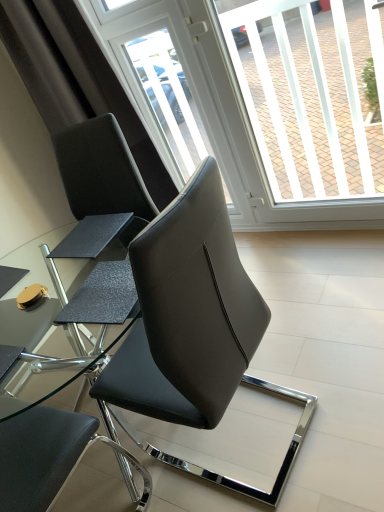
Question: Is black leather chair at center, the 2th chair in the back-to-front sequence, wider than matte black chair at center, marked as the third chair in a front-to-back arrangement?

Choices:
 (A) yes
 (B) no

Answer: (B)

Question: Does black leather chair at center, which is the 2th chair in front-to-back order, turn towards matte black chair at center, marked as the third chair in a front-to-back arrangement?

Choices:
 (A) yes
 (B) no

Answer: (A)

Question: Is the position of black leather chair at center, which is the 2th chair in front-to-back order, more distant than that of matte black chair at center, marked as the third chair in a front-to-back arrangement?

Choices:
 (A) yes
 (B) no

Answer: (B)

Question: Is matte black chair at center, the 1th chair positioned from the back, inside black leather chair at center, the 2th chair in the back-to-front sequence?

Choices:
 (A) no
 (B) yes

Answer: (A)

Question: From a real-world perspective, is black leather chair at center, which is the 2th chair in front-to-back order, physically below matte black chair at center, the 1th chair positioned from the back?

Choices:
 (A) yes
 (B) no

Answer: (A)

Question: Is the position of black leather chair at center, the 2th chair in the back-to-front sequence, less distant than that of matte black chair at center, the 1th chair positioned from the back?

Choices:
 (A) no
 (B) yes

Answer: (B)

Question: Is transparent plastic screen door at upper center next to matte black chair at center, marked as the third chair in a front-to-back arrangement?

Choices:
 (A) yes
 (B) no

Answer: (B)

Question: Can you confirm if transparent plastic screen door at upper center is bigger than matte black chair at center, the 1th chair positioned from the back?

Choices:
 (A) no
 (B) yes

Answer: (A)

Question: From a real-world perspective, is transparent plastic screen door at upper center physically above matte black chair at center, marked as the third chair in a front-to-back arrangement?

Choices:
 (A) no
 (B) yes

Answer: (B)

Question: From the image's perspective, is transparent plastic screen door at upper center under matte black chair at center, the 1th chair positioned from the back?

Choices:
 (A) no
 (B) yes

Answer: (A)

Question: Considering the relative sizes of transparent plastic screen door at upper center and matte black chair at center, marked as the third chair in a front-to-back arrangement, in the image provided, is transparent plastic screen door at upper center wider than matte black chair at center, marked as the third chair in a front-to-back arrangement,?

Choices:
 (A) yes
 (B) no

Answer: (B)

Question: Does transparent plastic screen door at upper center have a greater height compared to matte black chair at center, marked as the third chair in a front-to-back arrangement?

Choices:
 (A) yes
 (B) no

Answer: (A)

Question: Considering the relative sizes of matte black chair at center, marked as the third chair in a front-to-back arrangement, and black leather chair at center, which is the 1th chair from front to back, in the image provided, is matte black chair at center, marked as the third chair in a front-to-back arrangement, taller than black leather chair at center, which is the 1th chair from front to back,?

Choices:
 (A) yes
 (B) no

Answer: (B)